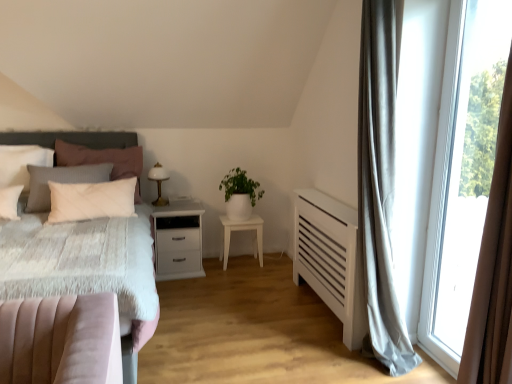
Question: Can you confirm if dark gray textured headboard at left is positioned to the right of white matte nightstand at center, which is counted as the 2th nightstand, starting from the right?

Choices:
 (A) no
 (B) yes

Answer: (A)

Question: Considering the relative positions of dark gray textured headboard at left and white matte nightstand at center, which is the first nightstand from left to right, in the image provided, is dark gray textured headboard at left in front of white matte nightstand at center, which is the first nightstand from left to right,?

Choices:
 (A) no
 (B) yes

Answer: (B)

Question: From the image's perspective, is dark gray textured headboard at left under white matte nightstand at center, which is the first nightstand from left to right?

Choices:
 (A) no
 (B) yes

Answer: (A)

Question: Can white matte nightstand at center, which is counted as the 2th nightstand, starting from the right, be found inside dark gray textured headboard at left?

Choices:
 (A) no
 (B) yes

Answer: (A)

Question: Considering the relative sizes of dark gray textured headboard at left and white matte nightstand at center, which is the first nightstand from left to right, in the image provided, is dark gray textured headboard at left smaller than white matte nightstand at center, which is the first nightstand from left to right,?

Choices:
 (A) no
 (B) yes

Answer: (A)

Question: Looking at their shapes, would you say white matte pillow at left, acting as the 2th pillow starting from the left, is wider or thinner than white glossy table lamp at center?

Choices:
 (A) wide
 (B) thin

Answer: (A)

Question: From a real-world perspective, is white matte pillow at left, acting as the 2th pillow starting from the left, positioned above or below white glossy table lamp at center?

Choices:
 (A) below
 (B) above

Answer: (B)

Question: Is white matte pillow at left, acting as the 2th pillow starting from the left, inside the boundaries of white glossy table lamp at center, or outside?

Choices:
 (A) outside
 (B) inside

Answer: (A)

Question: Considering the positions of white matte pillow at left, acting as the 2th pillow starting from the left, and white glossy table lamp at center in the image, is white matte pillow at left, acting as the 2th pillow starting from the left, bigger or smaller than white glossy table lamp at center?

Choices:
 (A) big
 (B) small

Answer: (A)

Question: Do you think white matte plant at center is within white matte pillow at left, acting as the 2th pillow starting from the left, or outside of it?

Choices:
 (A) outside
 (B) inside

Answer: (A)

Question: From a real-world perspective, is white matte plant at center above or below white matte pillow at left, acting as the 2th pillow starting from the left?

Choices:
 (A) above
 (B) below

Answer: (B)

Question: From the image's perspective, is white matte plant at center located above or below white matte pillow at left, acting as the 2th pillow starting from the left?

Choices:
 (A) below
 (B) above

Answer: (A)

Question: Relative to white matte pillow at left, which ranks as the 1th pillow in right-to-left order, is white matte plant at center in front or behind?

Choices:
 (A) behind
 (B) front

Answer: (A)

Question: Looking at the image, does white glossy table lamp at center seem bigger or smaller compared to white matte nightstand at center, the 1th nightstand in the right-to-left sequence?

Choices:
 (A) small
 (B) big

Answer: (A)

Question: From their relative heights in the image, would you say white glossy table lamp at center is taller or shorter than white matte nightstand at center, the 2th nightstand from the left?

Choices:
 (A) tall
 (B) short

Answer: (B)